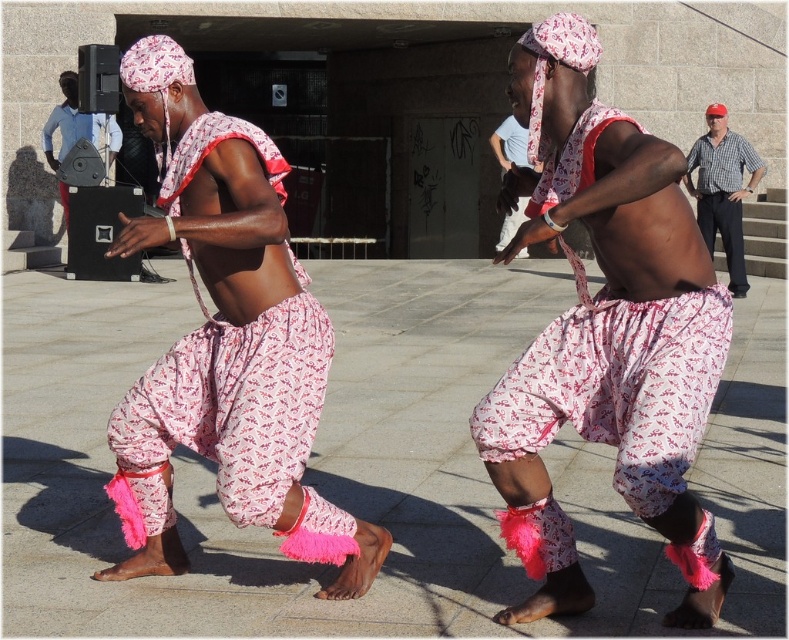
Question: Does checkered shirt at right appear over light blue cotton shirt at upper center?

Choices:
 (A) no
 (B) yes

Answer: (A)

Question: Does pink fabric pants at center have a lesser width compared to pink printed pants at center?

Choices:
 (A) yes
 (B) no

Answer: (A)

Question: Among these objects, which one is farthest from the camera?

Choices:
 (A) pink fabric pants at center
 (B) pink printed pants at center
 (C) light blue cotton shirt at upper center
 (D) checkered shirt at right

Answer: (D)

Question: Which object is positioned closest to the checkered shirt at right?

Choices:
 (A) light blue cotton shirt at upper center
 (B) pink printed pants at center

Answer: (A)

Question: Is pink fabric pants at center to the right of light blue cotton shirt at upper center from the viewer's perspective?

Choices:
 (A) yes
 (B) no

Answer: (B)

Question: Which object is the farthest from the pink fabric pants at center?

Choices:
 (A) light blue cotton shirt at upper center
 (B) pink printed pants at center
 (C) checkered shirt at right

Answer: (C)